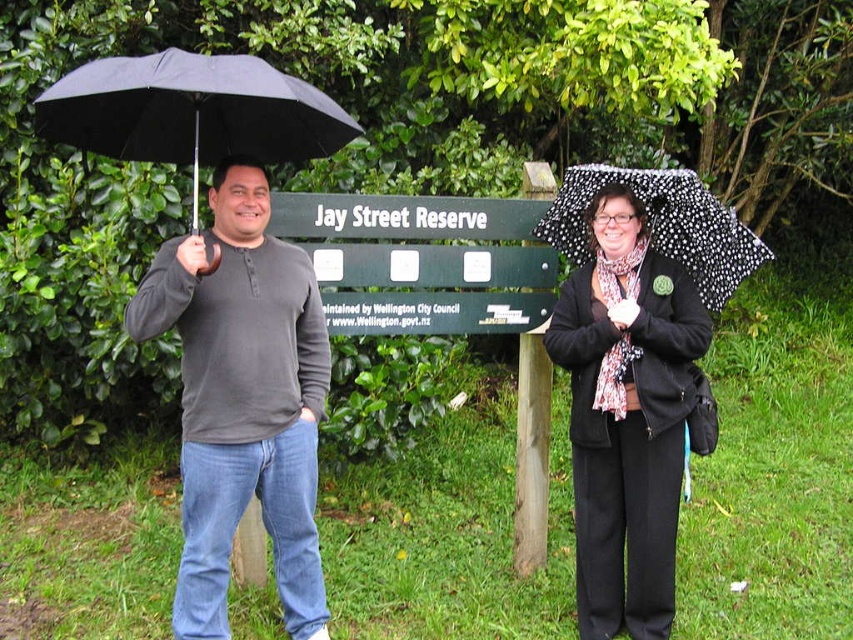
You are standing at the point labeled as point (x=242, y=401) in the image. Which object is located at this coordinate?

The dark gray henley shirt at left is located at point (x=242, y=401).

You are a photographer trying to capture a clear shot of both the dark gray henley shirt at left and the black matte umbrella at left. Based on their positions, which one is closer to the camera?

The dark gray henley shirt at left is below the black matte umbrella at left, so the umbrella is closer to the camera than the shirt.

You are a photographer trying to capture a photo of the dark gray henley shirt at left and the black dotted umbrella at upper right. Which object should you focus on first if you want to ensure both are in focus, considering their heights?

The dark gray henley shirt at left is taller than the black dotted umbrella at upper right, so you should focus on the dark gray henley shirt at left first to ensure both are in focus.